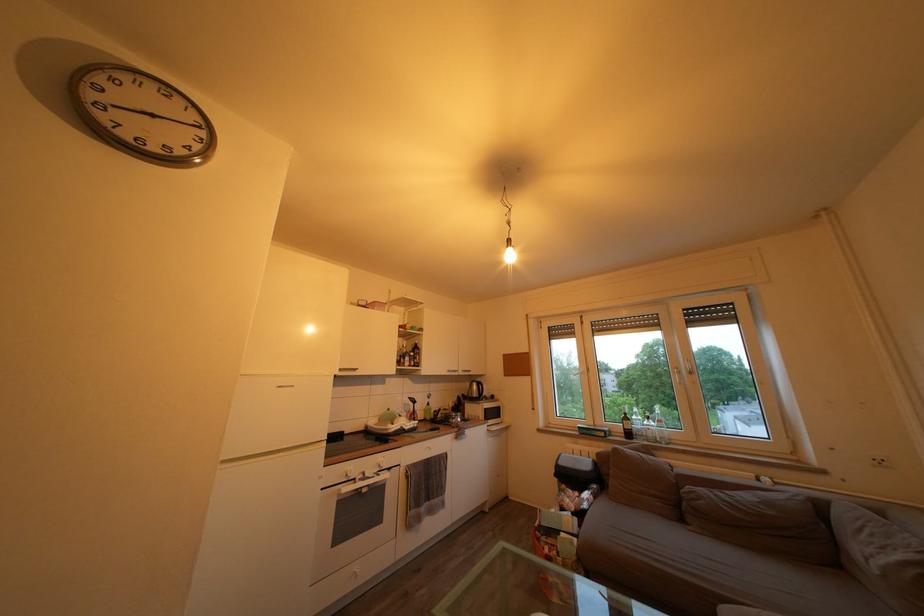
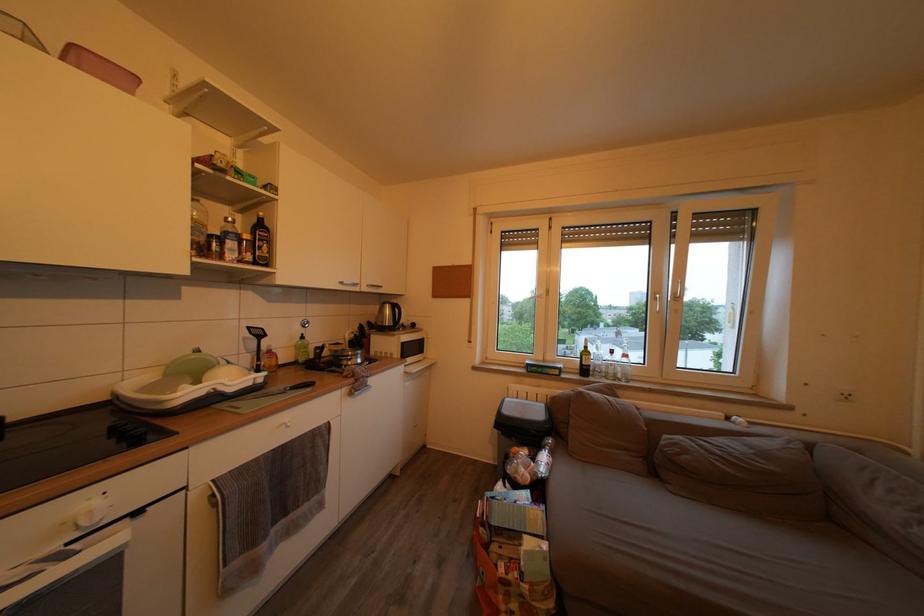
Locate, in the second image, the point that corresponds to [419,360] in the first image.

(253, 243)